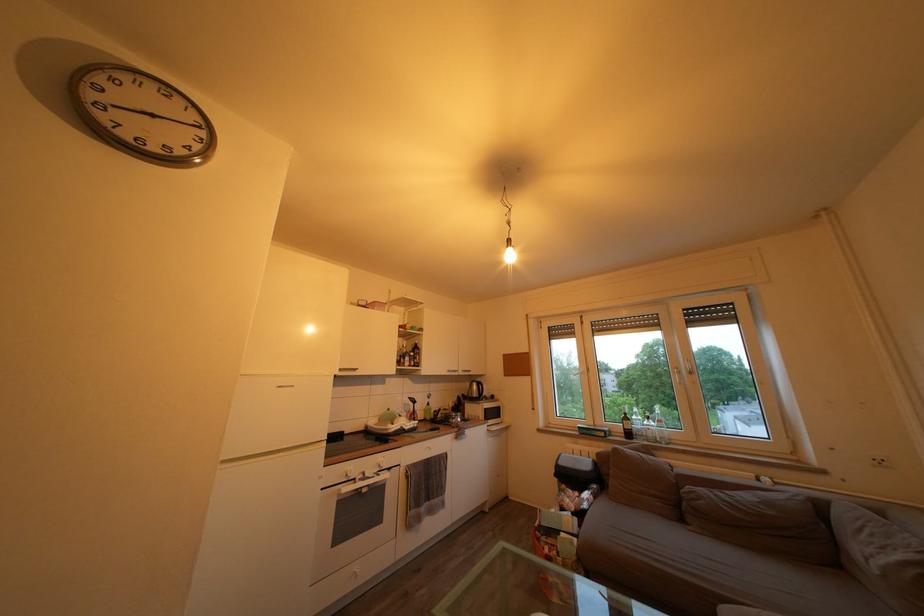
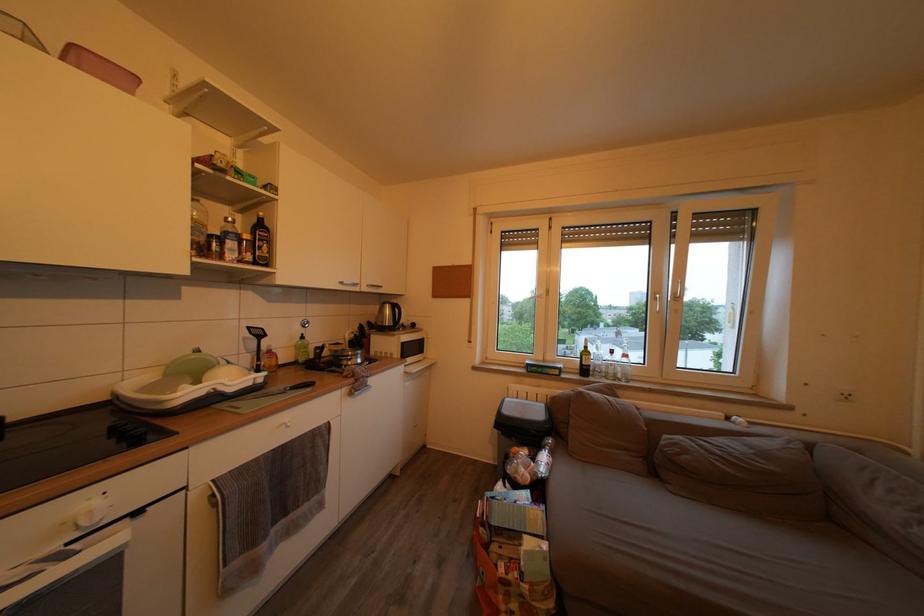
Locate, in the second image, the point that corresponds to [419,360] in the first image.

(253, 243)